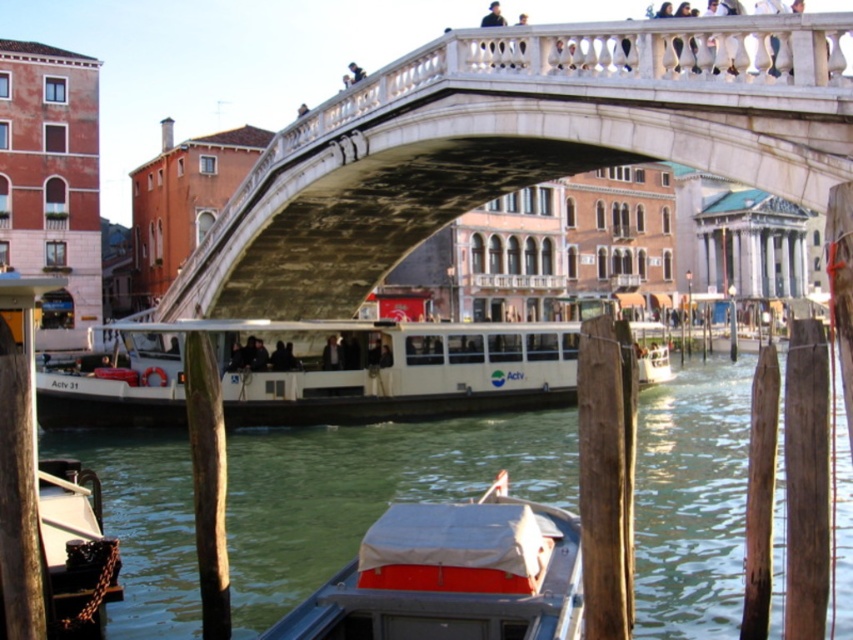
Is white matte boat at center to the right of white canvas boat at lower center from the viewer's perspective?

Indeed, white matte boat at center is positioned on the right side of white canvas boat at lower center.

Does white matte boat at center come in front of white canvas boat at lower center?

No, it is not.

At what (x,y) coordinates should I click in order to perform the action: click on white matte boat at center. Please return your answer as a coordinate pair (x, y). The width and height of the screenshot is (853, 640). Looking at the image, I should click on (321, 372).

Consider the image. Is white marble bridge at center below white canvas boat at lower center?

No.

Does point (457, 134) come farther from viewer compared to point (496, 524)?

Yes, point (457, 134) is behind point (496, 524).

Which is in front, point (598, 33) or point (492, 602)?

Point (492, 602)

Locate an element on the screen. white marble bridge at center is located at coordinates pyautogui.click(x=515, y=145).

Is white marble bridge at center to the left of white matte boat at center from the viewer's perspective?

Correct, you'll find white marble bridge at center to the left of white matte boat at center.

Is white marble bridge at center above white matte boat at center?

Correct, white marble bridge at center is located above white matte boat at center.

Which is behind, point (834, 156) or point (428, 371)?

Point (428, 371)

Identify the location of white marble bridge at center. The image size is (853, 640). (515, 145).